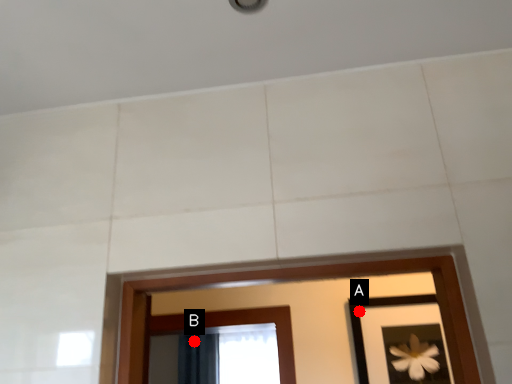
Question: Two points are circled on the image, labeled by A and B beside each circle. Which point is farther from the camera taking this photo?

Choices:
 (A) A is further
 (B) B is further

Answer: (B)